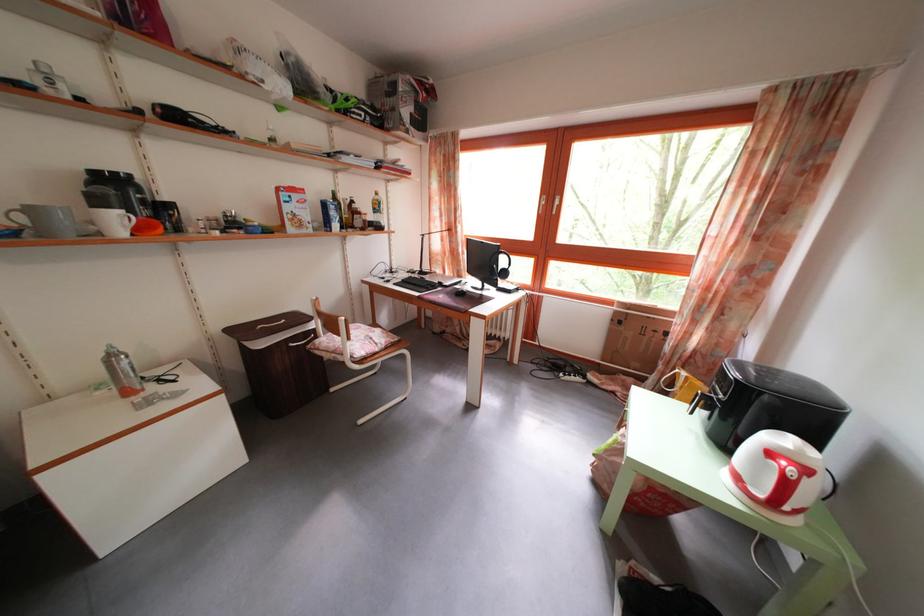
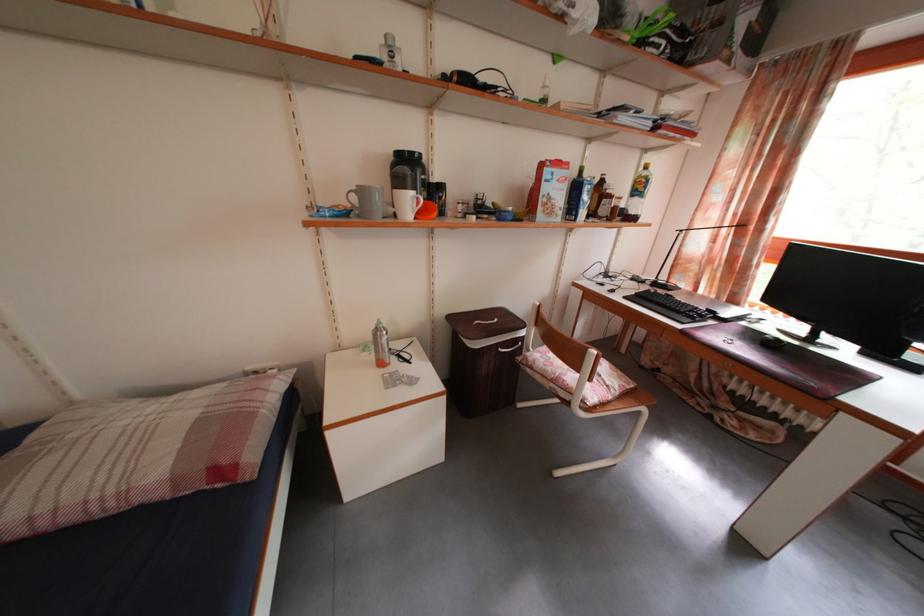
Find the pixel in the second image that matches the point at 30,225 in the first image.

(361, 206)